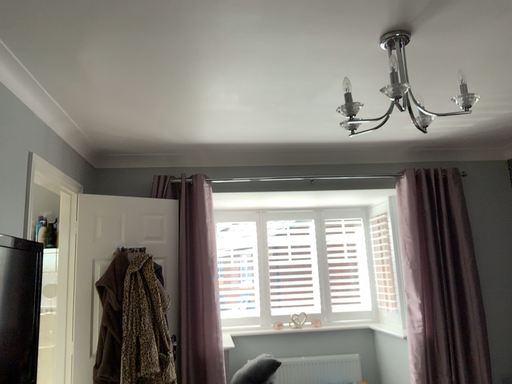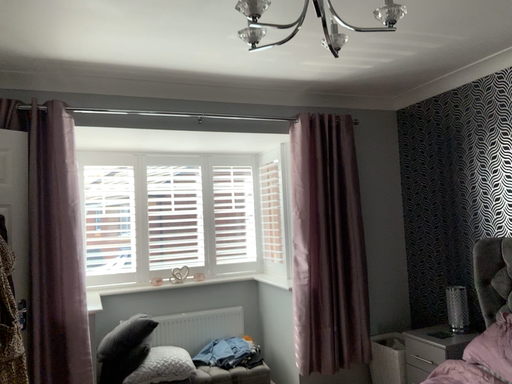
Question: How did the camera likely rotate when shooting the video?

Choices:
 (A) rotated right
 (B) rotated left

Answer: (A)